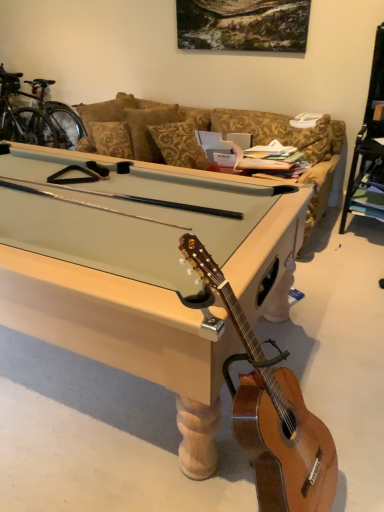
Measure the distance between point (275, 385) and camera.

The depth of point (275, 385) is 1.32 meters.

You are a GUI agent. You are given a task and a screenshot of the screen. Output one action in this format:
    pyautogui.click(x=<x>, y=<y>)
    Task: Click on the shiny metallic bicycle at upper left
    Image resolution: width=384 pixels, height=512 pixels.
    Given the screenshot: What is the action you would take?
    click(37, 116)

You are a GUI agent. You are given a task and a screenshot of the screen. Output one action in this format:
    pyautogui.click(x=<x>, y=<y>)
    Task: Click on the light brown wood guitar at lower right
    The width and height of the screenshot is (384, 512).
    Given the screenshot: What is the action you would take?
    pyautogui.click(x=272, y=414)

You are a GUI agent. You are given a task and a screenshot of the screen. Output one action in this format:
    pyautogui.click(x=<x>, y=<y>)
    Task: Click on the desk beneath the shiny metallic bicycle at upper left (from a real-world perspective)
    The image size is (384, 512).
    Given the screenshot: What is the action you would take?
    pyautogui.click(x=144, y=269)

Is light wood pool table at center situated inside shiny metallic bicycle at upper left or outside?

light wood pool table at center is spatially situated outside shiny metallic bicycle at upper left.

Can you confirm if light wood pool table at center is shorter than shiny metallic bicycle at upper left?

Yes, light wood pool table at center is shorter than shiny metallic bicycle at upper left.

Between point (127, 263) and point (41, 116), which one is positioned behind?

The point (41, 116) is farther.

Is shiny metallic bicycle at upper left at the right side of light wood pool table at center?

No, shiny metallic bicycle at upper left is not to the right of light wood pool table at center.

Is shiny metallic bicycle at upper left positioned before light wood pool table at center?

No, shiny metallic bicycle at upper left is behind light wood pool table at center.

Consider the image. Does shiny metallic bicycle at upper left have a greater width compared to light wood pool table at center?

No, shiny metallic bicycle at upper left is not wider than light wood pool table at center.

Does point (35, 86) lie behind point (147, 172)?

Yes, point (35, 86) is farther from viewer.

Does light brown wood guitar at lower right have a smaller size compared to shiny metallic bicycle at upper left?

Yes, light brown wood guitar at lower right is smaller than shiny metallic bicycle at upper left.

Considering the relative positions of light brown wood guitar at lower right and shiny metallic bicycle at upper left in the image provided, is light brown wood guitar at lower right to the left of shiny metallic bicycle at upper left from the viewer's perspective?

In fact, light brown wood guitar at lower right is to the right of shiny metallic bicycle at upper left.

In the scene shown: How much distance is there between light brown wood guitar at lower right and shiny metallic bicycle at upper left?

A distance of 3.76 meters exists between light brown wood guitar at lower right and shiny metallic bicycle at upper left.

Does point (241, 446) come closer to viewer compared to point (52, 126)?

Yes.

From a real-world perspective, is light wood pool table at center positioned over light brown wood guitar at lower right based on gravity?

No.

Is light wood pool table at center located outside light brown wood guitar at lower right?

light wood pool table at center lies outside light brown wood guitar at lower right's area.

In terms of height, does light wood pool table at center look taller or shorter compared to light brown wood guitar at lower right?

light wood pool table at center is shorter than light brown wood guitar at lower right.

Identify the location of desk behind the light brown wood guitar at lower right. The width and height of the screenshot is (384, 512). (144, 269).

Relative to light brown wood guitar at lower right, is shiny metallic bicycle at upper left in front or behind?

Visually, shiny metallic bicycle at upper left is located behind light brown wood guitar at lower right.

From a real-world perspective, does shiny metallic bicycle at upper left sit lower than light brown wood guitar at lower right?

Actually, shiny metallic bicycle at upper left is physically above light brown wood guitar at lower right in the real world.

Considering the relative sizes of shiny metallic bicycle at upper left and light brown wood guitar at lower right in the image provided, is shiny metallic bicycle at upper left wider than light brown wood guitar at lower right?

Yes, shiny metallic bicycle at upper left is wider than light brown wood guitar at lower right.

Which object is positioned more to the left, light brown wood guitar at lower right or light wood pool table at center?

From the viewer's perspective, light wood pool table at center appears more on the left side.

Does light brown wood guitar at lower right have a greater width compared to light wood pool table at center?

In fact, light brown wood guitar at lower right might be narrower than light wood pool table at center.

From a real-world perspective, is light brown wood guitar at lower right beneath light wood pool table at center?

Incorrect, from a real-world perspective, light brown wood guitar at lower right is higher than light wood pool table at center.

This screenshot has width=384, height=512. Find the location of `desk in front of the shiny metallic bicycle at upper left`. desk in front of the shiny metallic bicycle at upper left is located at coordinates (144, 269).

Locate an element on the screen. The height and width of the screenshot is (512, 384). bicycle above the light wood pool table at center (from the image's perspective) is located at coordinates (37, 116).

From the picture: Looking at the image, which one is located closer to light brown wood guitar at lower right, light wood pool table at center or shiny metallic bicycle at upper left?

The object closer to light brown wood guitar at lower right is light wood pool table at center.

Looking at the image, which one is located closer to shiny metallic bicycle at upper left, light brown wood guitar at lower right or light wood pool table at center?

light wood pool table at center is positioned closer to the anchor shiny metallic bicycle at upper left.

Based on their spatial positions, is light brown wood guitar at lower right or shiny metallic bicycle at upper left further from light wood pool table at center?

Based on the image, shiny metallic bicycle at upper left appears to be further to light wood pool table at center.

From the image, which object appears to be nearer to light wood pool table at center, shiny metallic bicycle at upper left or light brown wood guitar at lower right?

The object closer to light wood pool table at center is light brown wood guitar at lower right.

Which object lies further to the anchor point shiny metallic bicycle at upper left, light wood pool table at center or light brown wood guitar at lower right?

light brown wood guitar at lower right lies further to shiny metallic bicycle at upper left than the other object.

Which object lies further to the anchor point light brown wood guitar at lower right, shiny metallic bicycle at upper left or light wood pool table at center?

shiny metallic bicycle at upper left.

Image resolution: width=384 pixels, height=512 pixels. Find the location of `desk between light brown wood guitar at lower right and shiny metallic bicycle at upper left along the z-axis`. desk between light brown wood guitar at lower right and shiny metallic bicycle at upper left along the z-axis is located at coordinates (144, 269).